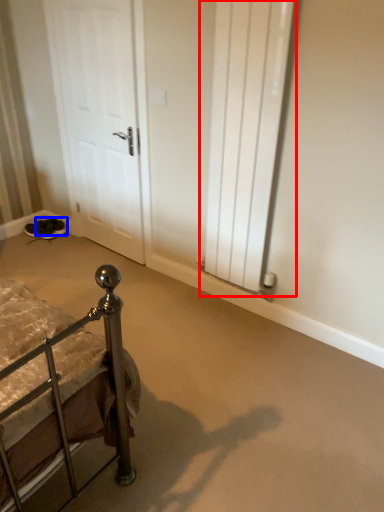
Question: Which point is closer to the camera, radiator (highlighted by a red box) or footwear (highlighted by a blue box)?

Choices:
 (A) radiator
 (B) footwear

Answer: (A)